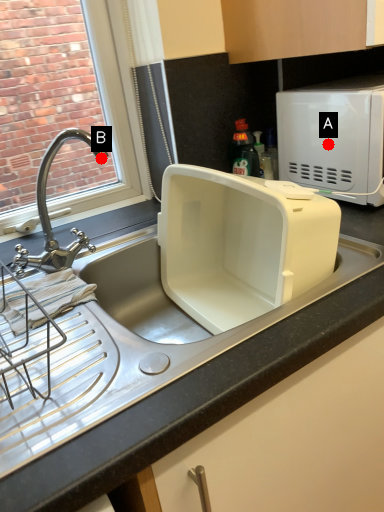
Question: Two points are circled on the image, labeled by A and B beside each circle. Which of the following is the farthest from the observer?

Choices:
 (A) A is further
 (B) B is further

Answer: (A)